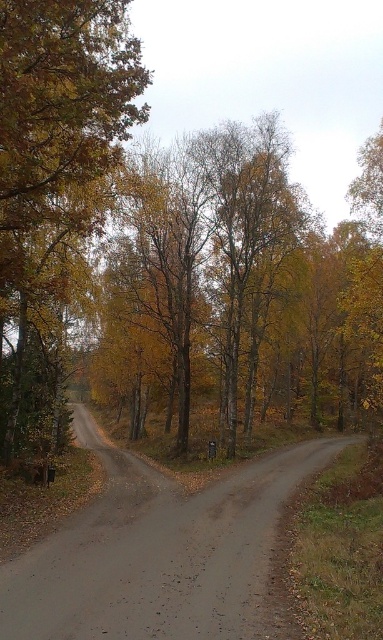
Does yellow-green foliage at left have a smaller size compared to gray gravel road at center?

Actually, yellow-green foliage at left might be larger than gray gravel road at center.

Between yellow-green foliage at left and gray gravel road at center, which one has less height?

Standing shorter between the two is gray gravel road at center.

What do you see at coordinates (55, 188) in the screenshot?
I see `yellow-green foliage at left` at bounding box center [55, 188].

Locate an element on the screen. The width and height of the screenshot is (383, 640). yellow-green foliage at left is located at coordinates (55, 188).